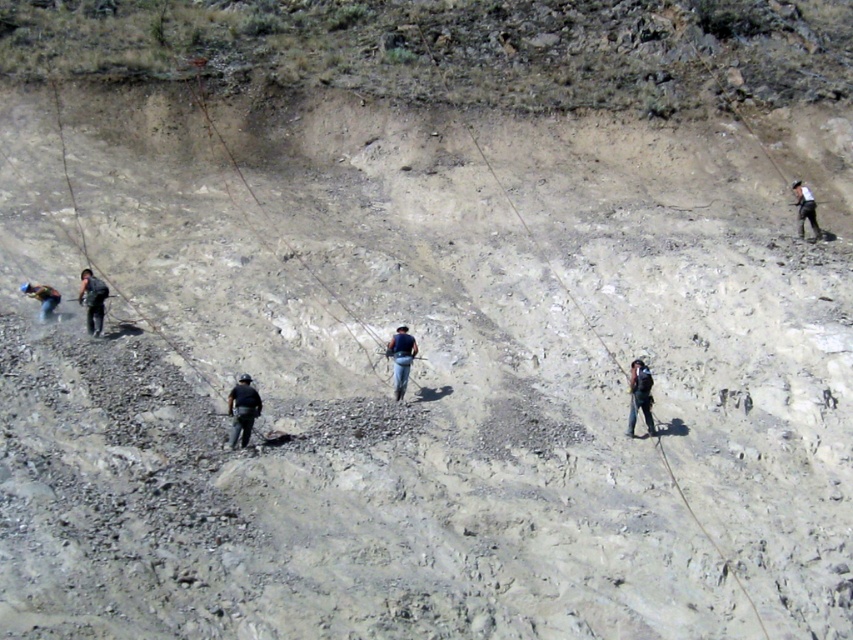
Question: Does dark blue uniform at center appear under dark blue jeans at right?

Choices:
 (A) no
 (B) yes

Answer: (B)

Question: From the image, what is the correct spatial relationship of dark blue fabric backpack at center in relation to blue fabric backpack at center?

Choices:
 (A) above
 (B) below

Answer: (B)

Question: Which object appears closest to the camera in this image?

Choices:
 (A) dark blue fabric backpack at center
 (B) dark blue jeans at right
 (C) dark blue uniform at center

Answer: (C)

Question: Does dark blue fabric backpack at center appear over black matte jacket at center?

Choices:
 (A) no
 (B) yes

Answer: (A)

Question: Which object is the farthest from the dark blue fabric backpack at center?

Choices:
 (A) dark blue jeans at right
 (B) blue fabric backpack at center

Answer: (A)

Question: Which object appears closest to the camera in this image?

Choices:
 (A) blue fabric backpack at center
 (B) dark blue uniform at center

Answer: (B)